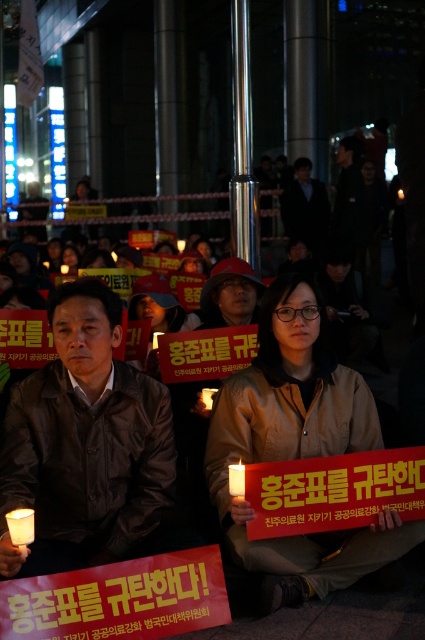
Question: Does brown matte jacket at center have a lesser width compared to white wax candle at lower left?

Choices:
 (A) yes
 (B) no

Answer: (B)

Question: Among these points, which one is farthest from the camera?

Choices:
 (A) (31, 515)
 (B) (217, 444)
 (C) (232, 483)

Answer: (B)

Question: Which point is closer to the camera taking this photo?

Choices:
 (A) (243, 474)
 (B) (20, 522)
 (C) (303, 547)

Answer: (B)

Question: Can you confirm if brown matte jacket at center is wider than white wax candle at lower left?

Choices:
 (A) no
 (B) yes

Answer: (B)

Question: Which object is positioned farthest from the brown matte jacket at center?

Choices:
 (A) white wax candle at center
 (B) white wax candle at lower left
 (C) brown leather jacket at center

Answer: (B)

Question: Does white wax candle at lower left have a lesser width compared to white wax candle at center?

Choices:
 (A) no
 (B) yes

Answer: (A)